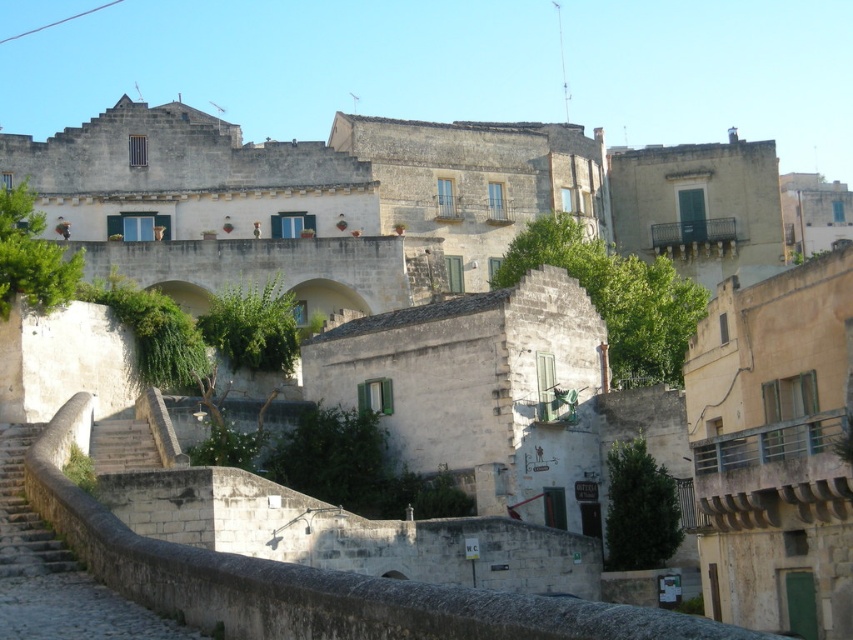
Question: Which object appears farthest from the camera in this image?

Choices:
 (A) smooth stone stairs at lower left
 (B) stone stairs at lower left

Answer: (A)

Question: Can you confirm if stone stairs at lower left is bigger than smooth stone stairs at lower left?

Choices:
 (A) no
 (B) yes

Answer: (B)

Question: Is stone stairs at lower left to the right of smooth stone stairs at lower left from the viewer's perspective?

Choices:
 (A) yes
 (B) no

Answer: (B)

Question: Is stone stairs at lower left smaller than smooth stone stairs at lower left?

Choices:
 (A) no
 (B) yes

Answer: (A)

Question: Which point is closer to the camera?

Choices:
 (A) (26, 557)
 (B) (113, 465)

Answer: (A)